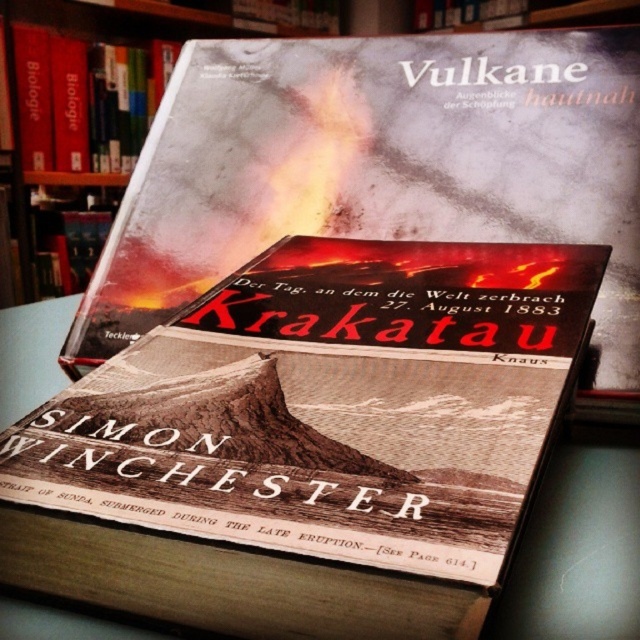
Question: Can you confirm if sepia-toned paper at center is positioned below hardcover book at upper center?

Choices:
 (A) no
 (B) yes

Answer: (B)

Question: Which of these objects is positioned closest to the hardcover book at upper center?

Choices:
 (A) matte paper book at center
 (B) sepia-toned paper at center

Answer: (A)

Question: Does matte paper book at center have a larger size compared to hardcover book at upper center?

Choices:
 (A) no
 (B) yes

Answer: (B)

Question: Is matte paper book at center above hardcover book at upper center?

Choices:
 (A) no
 (B) yes

Answer: (A)

Question: Which point appears farthest from the camera in this image?

Choices:
 (A) pos(51,88)
 (B) pos(616,182)

Answer: (A)

Question: Which of the following is the closest to the observer?

Choices:
 (A) (72, 45)
 (B) (449, 483)

Answer: (B)